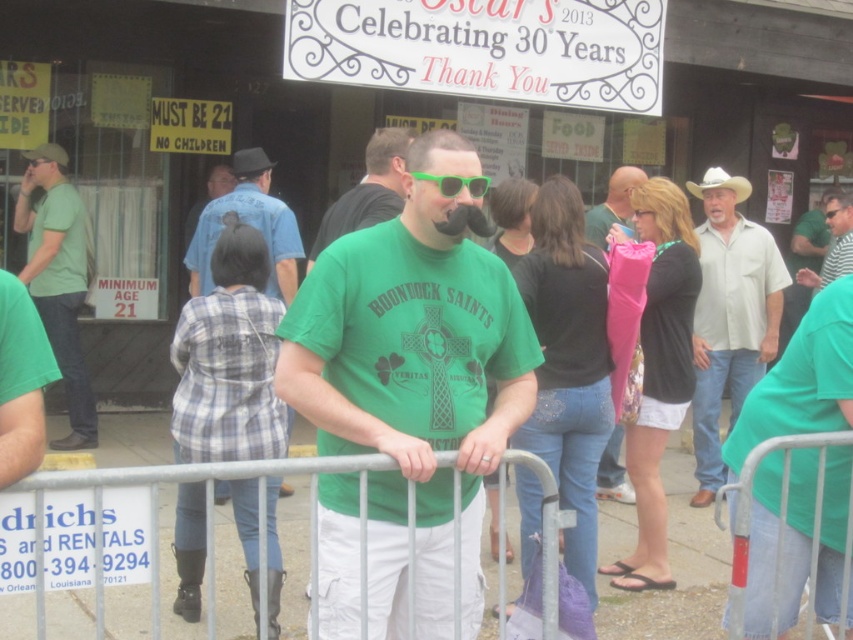
Who is positioned more to the right, metal at center or green plastic sunglasses at center?

green plastic sunglasses at center

Can you confirm if metal at center is bigger than green plastic sunglasses at center?

Yes, metal at center is bigger than green plastic sunglasses at center.

Is point (167, 477) positioned before point (428, 177)?

Yes, point (167, 477) is in front of point (428, 177).

Find the location of a particular element. The width and height of the screenshot is (853, 640). metal at center is located at coordinates (154, 506).

Between point (386, 200) and point (480, 193), which one is positioned behind?

The point (386, 200) is more distant.

Is green matte shirt at center to the left of green plastic sunglasses at center from the viewer's perspective?

Yes, green matte shirt at center is to the left of green plastic sunglasses at center.

The width and height of the screenshot is (853, 640). Identify the location of green matte shirt at center. (368, 189).

Does metal at center appear on the left side of blue plaid shirt at center?

In fact, metal at center is to the right of blue plaid shirt at center.

Between point (44, 621) and point (250, 168), which one is positioned in front?

Point (44, 621)

Is point (44, 481) farther from viewer compared to point (213, 244)?

No, (44, 481) is closer to viewer.

Locate an element on the screen. The width and height of the screenshot is (853, 640). metal at center is located at coordinates pos(154,506).